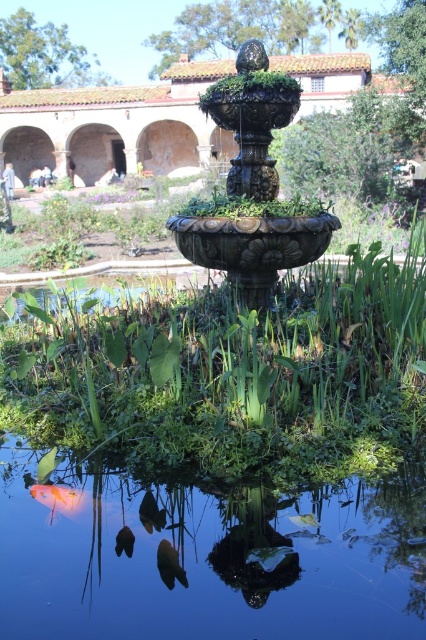
You are a visitor in the garden and want to take a photo of the orange glossy fish at lower left. Since the glossy blue water at center bottom is in the way, will you need to adjust your camera angle upwards or downwards to get a clear shot of the fish?

→ The glossy blue water at center bottom is below the orange glossy fish at lower left, so you need to adjust your camera angle upwards to get a clear shot of the orange glossy fish at lower left without the water blocking it.

You are a visitor in the garden and want to take a photo of both the bronze textured fountain at center and the orange glossy fish at lower left. Which object should you focus on first if you want to ensure both are in the frame without moving the camera?

You should focus on the bronze textured fountain at center first because it is positioned to the right of the orange glossy fish at lower left, so keeping the fountain in the frame will also include the fish if the camera angle is adjusted properly.

You are standing in the garden and want to know if the glossy blue water at center bottom is taller than the bronze textured fountain at center. Based on the scene, what can you conclude?

The glossy blue water at center bottom is not as tall as the bronze textured fountain at center, so the fountain is taller.